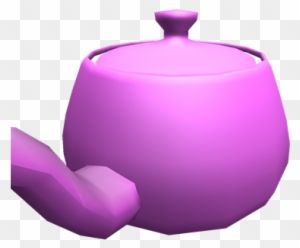
Where is `teapot`? This screenshot has width=300, height=248. teapot is located at coordinates (178, 173).